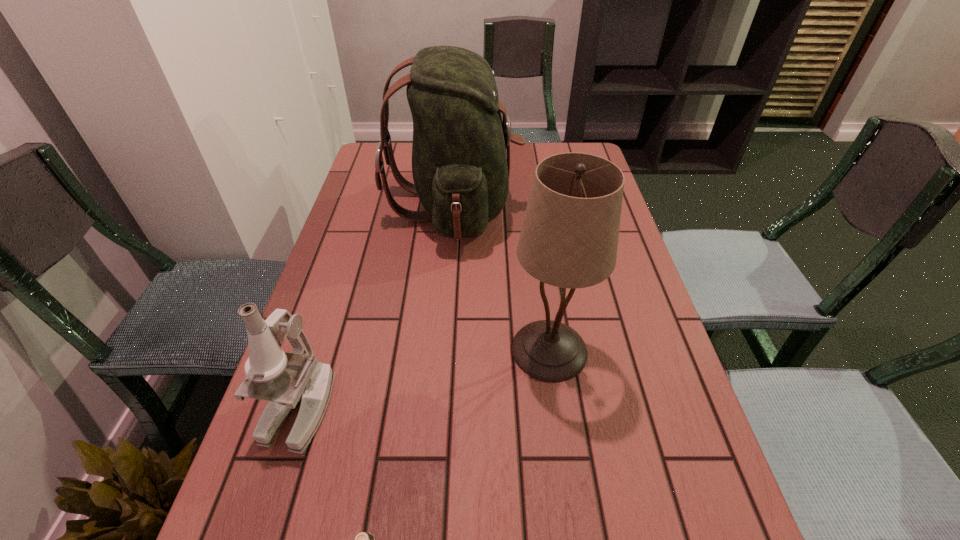
Identify the location of backpack present at the left edge. (461, 174).

You are a GUI agent. You are given a task and a screenshot of the screen. Output one action in this format:
    pyautogui.click(x=<x>, y=<y>)
    Task: Click on the microscope at the left edge
    
    Given the screenshot: What is the action you would take?
    click(x=287, y=380)

Find the location of `object at the far left corner`. object at the far left corner is located at coordinates (461, 174).

Where is `vacant area at the left edge`? The width and height of the screenshot is (960, 540). vacant area at the left edge is located at coordinates (339, 253).

In the image, there is a desktop. Where is `free space at the right edge`? The height and width of the screenshot is (540, 960). free space at the right edge is located at coordinates (629, 264).

At what (x,y) coordinates should I click in order to perform the action: click on free space at the far left corner. Please return your answer as a coordinate pair (x, y). Image resolution: width=960 pixels, height=540 pixels. Looking at the image, I should click on (373, 148).

At what (x,y) coordinates should I click in order to perform the action: click on vacant space at the far right corner of the desktop. Please return your answer as a coordinate pair (x, y). This screenshot has width=960, height=540. Looking at the image, I should click on click(567, 147).

Find the location of a particular element. Image resolution: width=960 pixels, height=540 pixels. vacant area between the leftmost object and the farthest object is located at coordinates (377, 307).

This screenshot has height=540, width=960. In order to click on free space between the lampshade and the backpack in this screenshot , I will do `click(502, 278)`.

This screenshot has height=540, width=960. I want to click on free space that is in between the farthest object and the microscope, so click(377, 307).